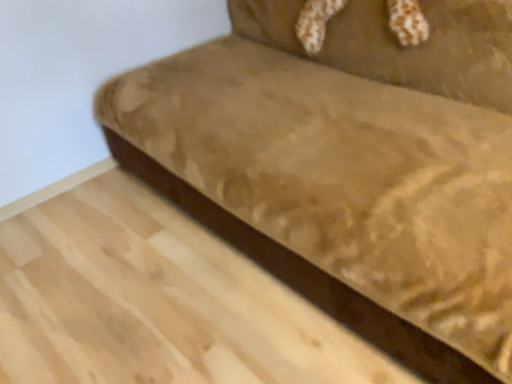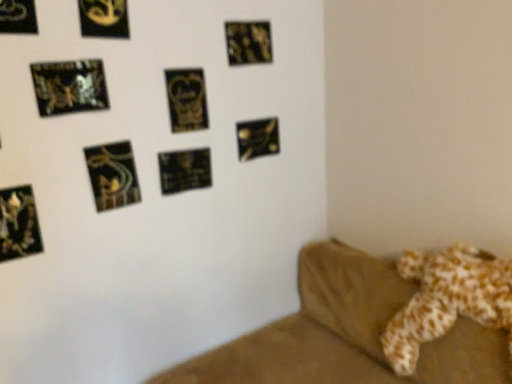
Question: Which way did the camera rotate in the video?

Choices:
 (A) rotated right
 (B) rotated left

Answer: (B)